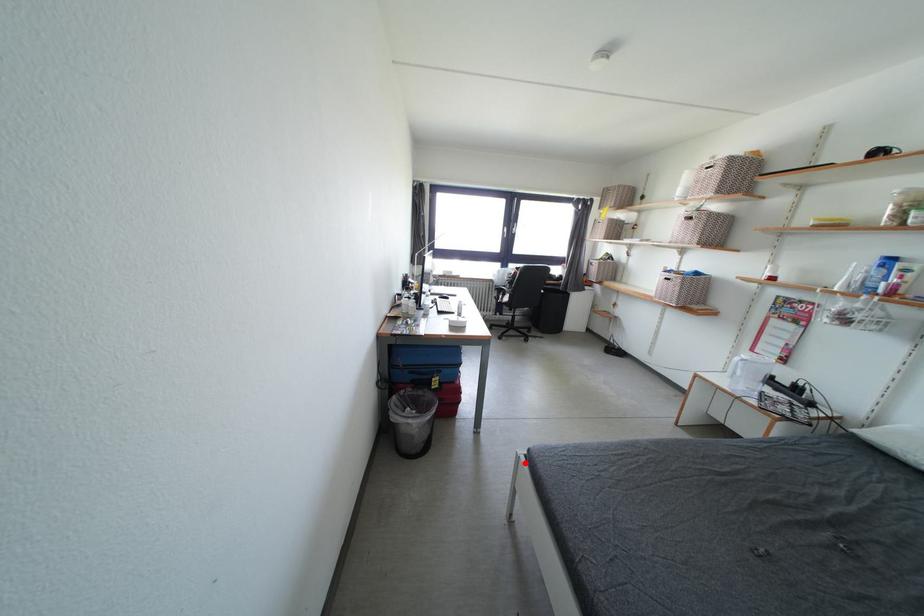
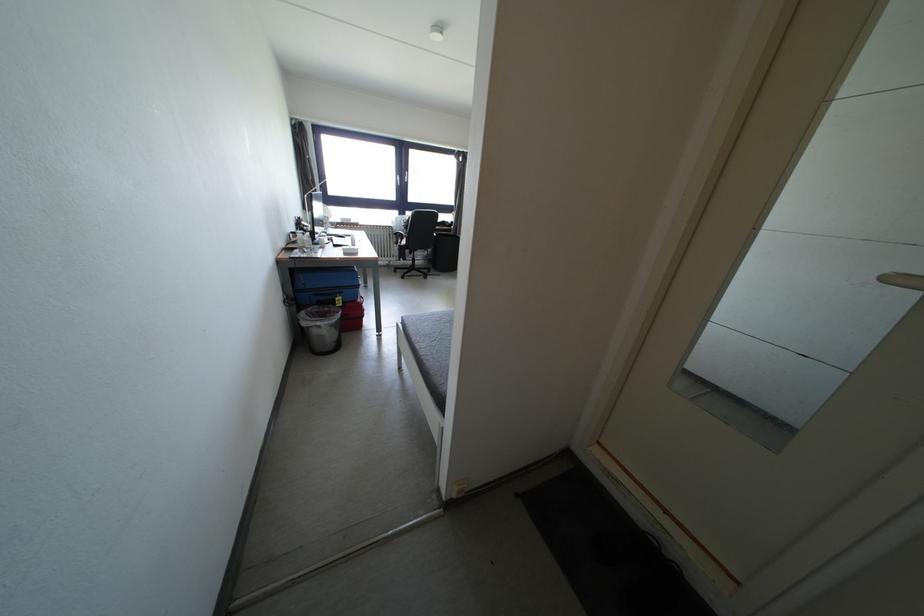
The point at the highlighted location is marked in the first image. Where is the corresponding point in the second image?

(403, 330)